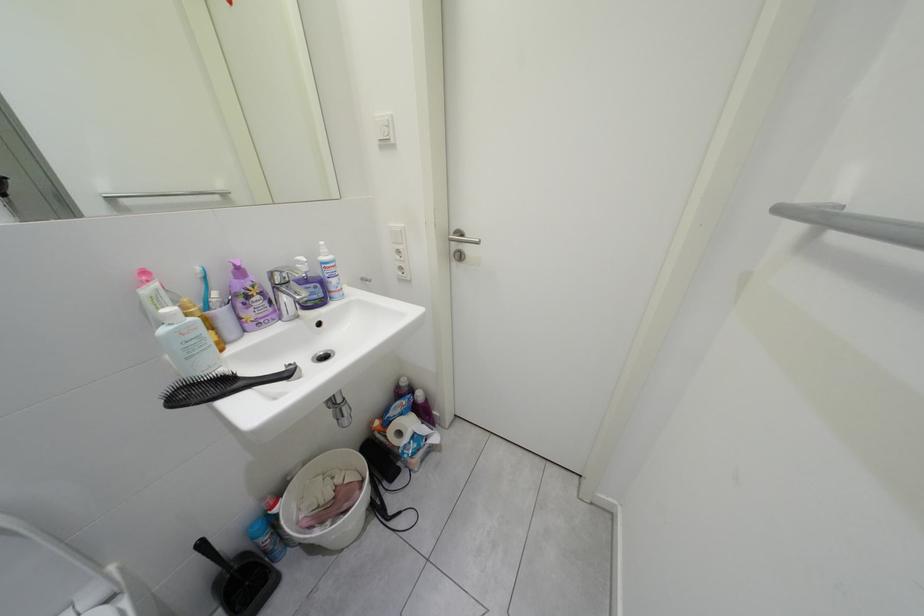
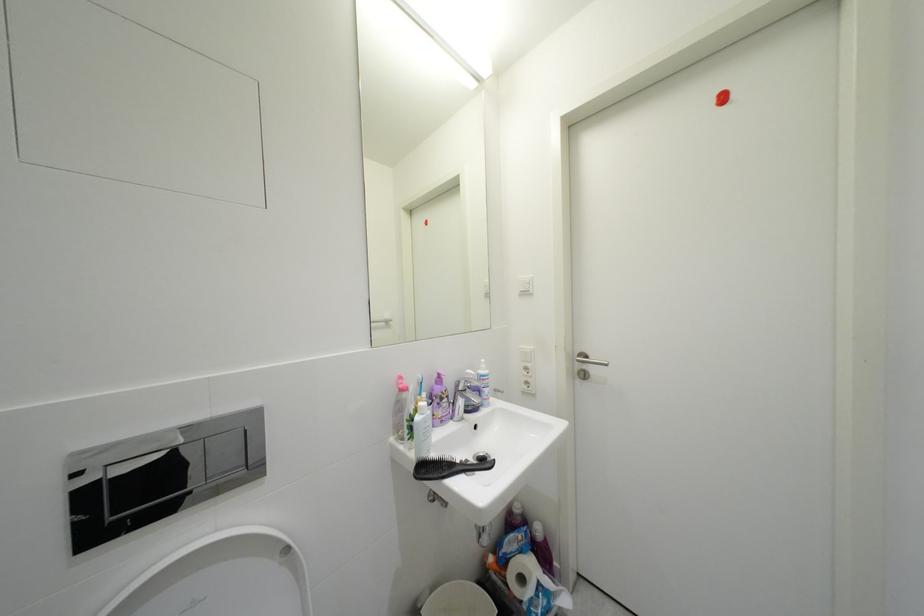
The first image is from the beginning of the video and the second image is from the end. How did the camera likely rotate when shooting the video?

The rotation direction of the camera is left-up.